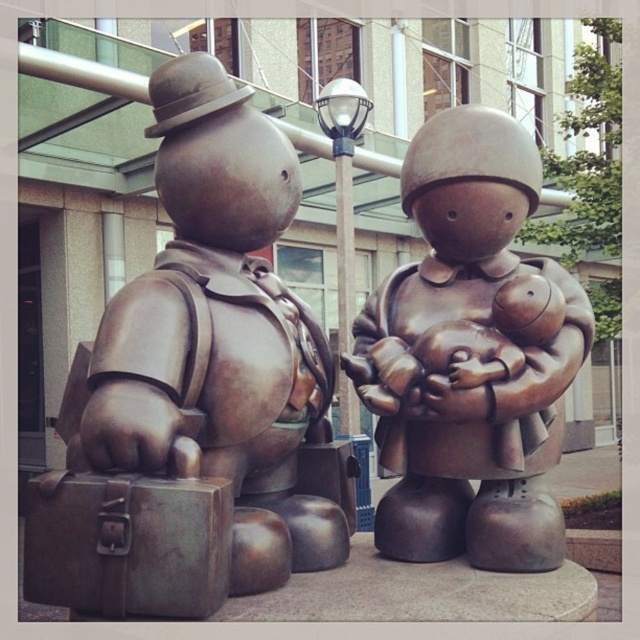
You are standing at the entrance of the public space and want to locate the bronze statue at center. According to the coordinates provided, where should you look to find it?

The bronze statue at center is located at coordinates point (467, 356).

You are an art curator planning to move the bronze suitcase at lower left closer to the modern buildings in the background. Which direction should you move it relative to the brushed metal briefcase at left?

The bronze suitcase at lower left should be moved to the right to align it closer to the modern buildings in the background since the brushed metal briefcase at left is already positioned to its right.

You are a photographer planning to take a photo of the bronze statue at center. You notice the brushed metal briefcase at left might block the view. Based on their positions, will the briefcase obscure the statue in your photo?

The brushed metal briefcase at left is in front of the bronze statue at center, so it will block the view of the statue in the photo.